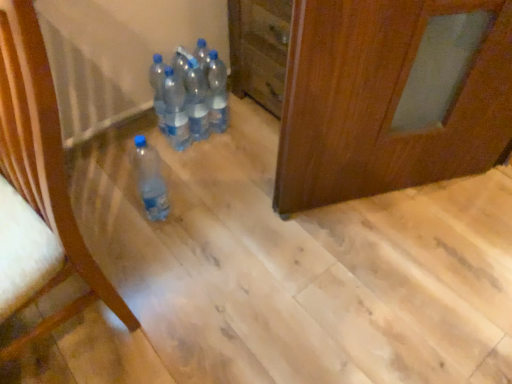
The height and width of the screenshot is (384, 512). What are the coordinates of `vacant space behind transparent plastic bottles at center, the first bottle positioned from the right` in the screenshot? It's located at (236, 106).